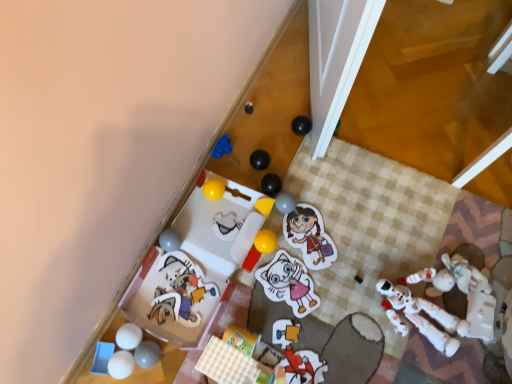
You are a GUI agent. You are given a task and a screenshot of the screen. Output one action in this format:
    pyautogui.click(x=<x>, y=<y>)
    Task: Click on the free space to the right of white rubber ball at lower left, which is the fourteenth toy from right to left
    Image resolution: width=512 pixels, height=384 pixels.
    Given the screenshot: What is the action you would take?
    pyautogui.click(x=187, y=351)